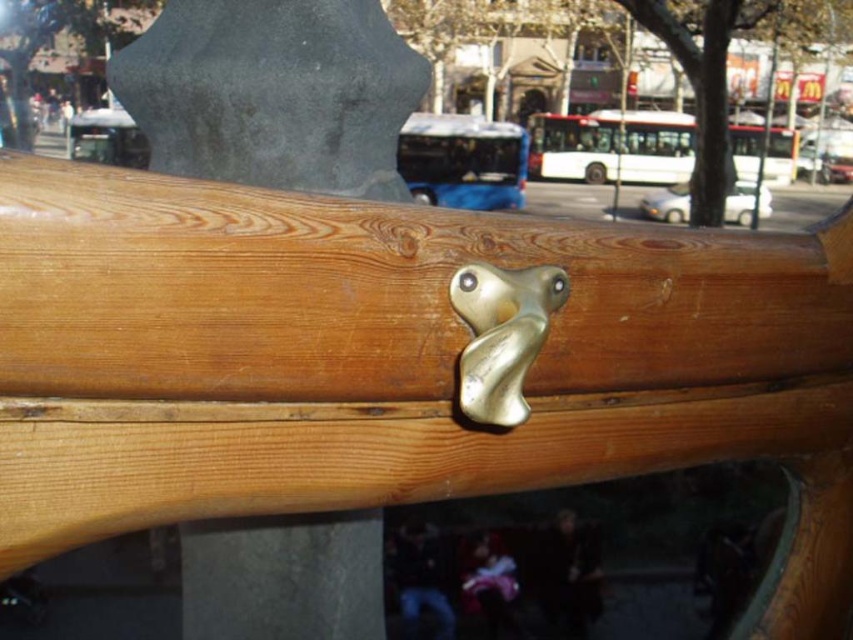
You are a maintenance worker checking the handles on a railing. You notice two handles at the center. Which handle is closer to you, the matte wood handle at center or the gold metallic door handle at center?

The matte wood handle at center is closer to you because the gold metallic door handle at center is positioned behind it.

You are standing in front of the wooden railing with the metallic handle. There is a point marked at coordinates (273, 93). What object is located at that point?

The point at coordinates (273, 93) corresponds to the matte wood handle at center.

You are trying to open the door but can only reach up to shoulder height. The matte wood handle at center and the gold metallic door handle at center are both on the door. Which handle can you reach?

The matte wood handle at center is located above the gold metallic door handle at center. Since you can only reach up to shoulder height, you might not be able to reach the matte wood handle at center, but you can definitely reach the gold metallic door handle at center.